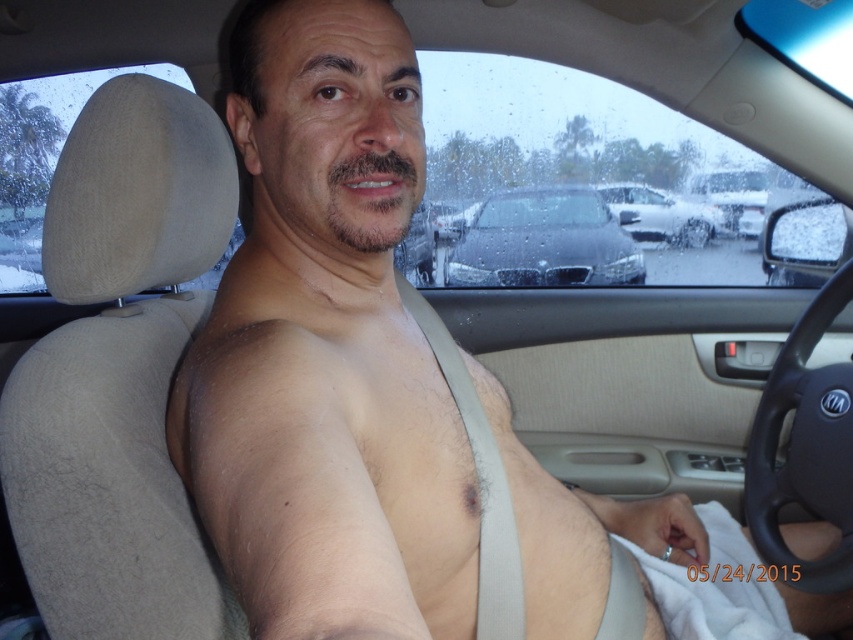
Question: Estimate the real-world distances between objects in this image. Which object is closer to the black metallic car at center?

Choices:
 (A) silver metallic sedan at center
 (B) white fabric at lower right

Answer: (A)

Question: Is black metallic car at center smaller than white fabric at lower right?

Choices:
 (A) yes
 (B) no

Answer: (B)

Question: Observing the image, what is the correct spatial positioning of white fabric at lower right in reference to silver metallic sedan at center?

Choices:
 (A) above
 (B) below

Answer: (B)

Question: Considering the relative positions of black metallic car at center and white fabric at lower right in the image provided, where is black metallic car at center located with respect to white fabric at lower right?

Choices:
 (A) below
 (B) above

Answer: (B)

Question: Estimate the real-world distances between objects in this image. Which object is farther from the silver metallic sedan at center?

Choices:
 (A) white fabric at lower right
 (B) black metallic car at center

Answer: (A)

Question: Estimate the real-world distances between objects in this image. Which object is farther from the black metallic car at center?

Choices:
 (A) silver metallic sedan at center
 (B) white fabric at lower right

Answer: (B)